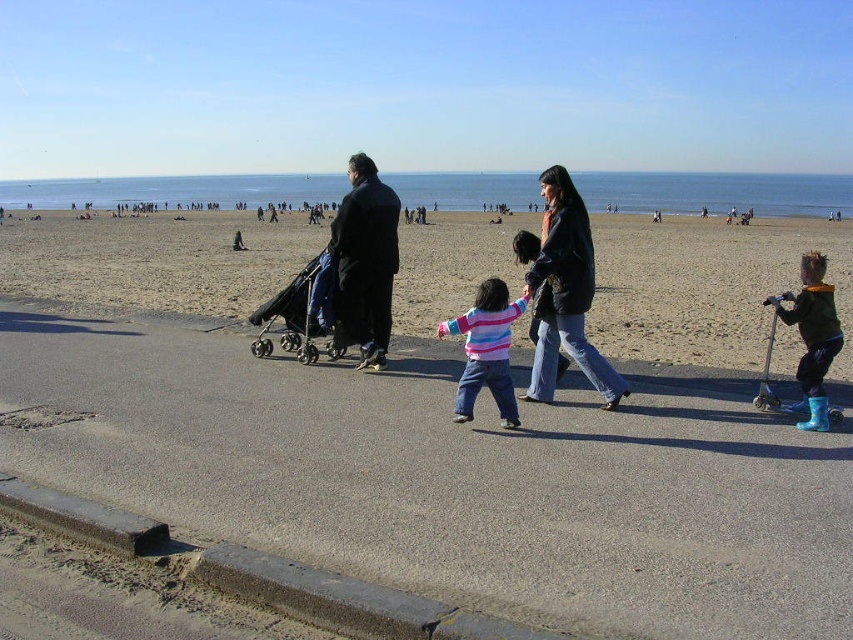
Can you confirm if sandy beach at lower center is taller than black matte coat at center?

Indeed, sandy beach at lower center has a greater height compared to black matte coat at center.

Which of these two, sandy beach at lower center or black matte coat at center, stands shorter?

black matte coat at center is shorter.

Who is more forward, (146, 292) or (363, 282)?

Point (363, 282) is more forward.

You are a GUI agent. You are given a task and a screenshot of the screen. Output one action in this format:
    pyautogui.click(x=<x>, y=<y>)
    Task: Click on the sandy beach at lower center
    This screenshot has width=853, height=640.
    Given the screenshot: What is the action you would take?
    pyautogui.click(x=705, y=285)

Does matte black jacket at center appear on the left side of black matte coat at center?

In fact, matte black jacket at center is to the right of black matte coat at center.

Does matte black jacket at center have a greater width compared to black matte coat at center?

Yes.

At what (x,y) coordinates should I click in order to perform the action: click on matte black jacket at center. Please return your answer as a coordinate pair (x, y). This screenshot has height=640, width=853. Looking at the image, I should click on (566, 292).

This screenshot has height=640, width=853. Find the location of `matte black jacket at center`. matte black jacket at center is located at coordinates coord(566,292).

Is sandy beach at lower center below rubber boots at right?

No, sandy beach at lower center is not below rubber boots at right.

Is sandy beach at lower center to the right of rubber boots at right from the viewer's perspective?

No, sandy beach at lower center is not to the right of rubber boots at right.

Locate an element on the screen. This screenshot has width=853, height=640. sandy beach at lower center is located at coordinates (705, 285).

Locate an element on the screen. sandy beach at lower center is located at coordinates (705, 285).